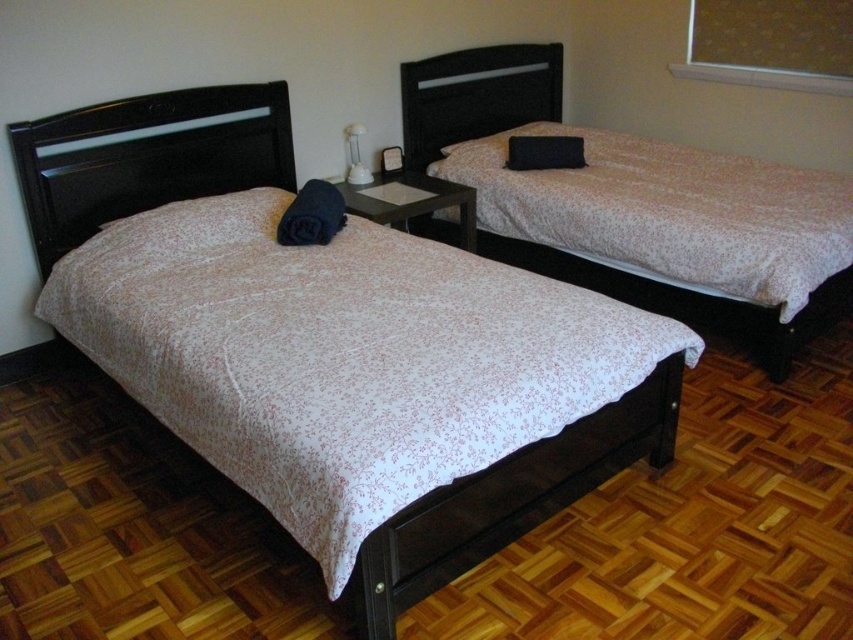
In the scene shown: Is black matte pillow at upper right to the left of white glossy lamp at center from the viewer's perspective?

Incorrect, black matte pillow at upper right is not on the left side of white glossy lamp at center.

Who is positioned more to the left, black matte pillow at upper right or white glossy lamp at center?

white glossy lamp at center

Identify the location of black matte pillow at upper right. The image size is (853, 640). (544, 152).

In the scene shown: Can you confirm if white floral fabric bed at center is positioned to the right of white glossy lamp at center?

Indeed, white floral fabric bed at center is positioned on the right side of white glossy lamp at center.

Who is higher up, white floral fabric bed at center or white glossy lamp at center?

white glossy lamp at center

This screenshot has width=853, height=640. Describe the element at coordinates (476, 96) in the screenshot. I see `white floral fabric bed at center` at that location.

Locate an element on the screen. white floral fabric bed at center is located at coordinates (476, 96).

Is point (415, 577) closer to viewer compared to point (471, 122)?

Yes, point (415, 577) is in front of point (471, 122).

Which is above, white floral fabric bed at left or white floral fabric bed at center?

white floral fabric bed at left

Who is more distant from viewer, (222, 100) or (727, 317)?

The point (222, 100) is more distant.

Locate an element on the screen. The image size is (853, 640). white floral fabric bed at left is located at coordinates (146, 157).